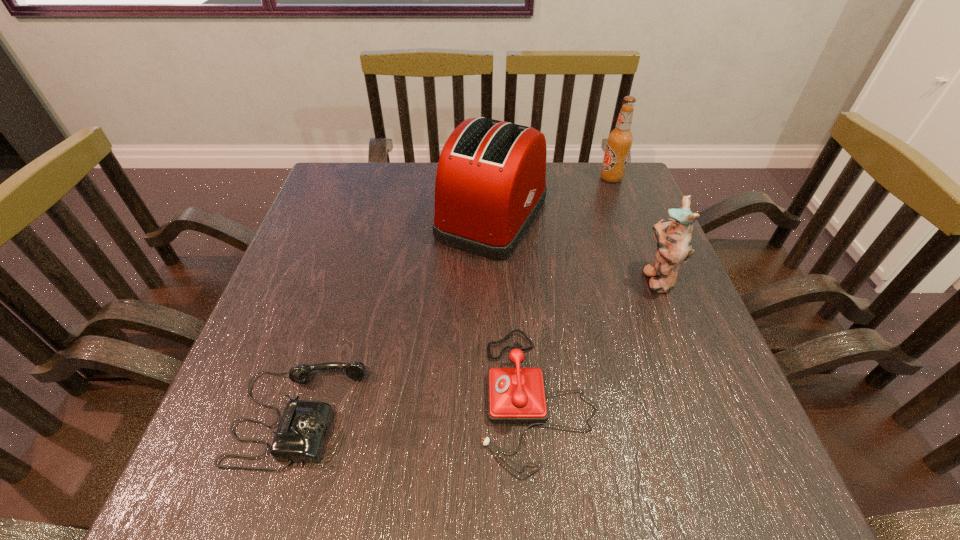
Identify the location of vacant area between the right telephone and the leftmost object. (418, 406).

The image size is (960, 540). What are the coordinates of `vacant region between the leftmost object and the right telephone` in the screenshot? It's located at (418, 406).

You are a GUI agent. You are given a task and a screenshot of the screen. Output one action in this format:
    pyautogui.click(x=<x>, y=<y>)
    Task: Click on the free space between the toaster and the beer bottle
    
    Given the screenshot: What is the action you would take?
    pyautogui.click(x=552, y=197)

Where is `free space between the leftmost object and the right telephone`? The height and width of the screenshot is (540, 960). free space between the leftmost object and the right telephone is located at coordinates tap(418, 406).

In order to click on free spot between the beer bottle and the figurine in this screenshot , I will do `click(634, 228)`.

This screenshot has height=540, width=960. I want to click on free space between the right telephone and the toaster, so click(516, 306).

This screenshot has height=540, width=960. I want to click on empty location between the leftmost object and the toaster, so click(x=396, y=316).

At what (x,y) coordinates should I click in order to perform the action: click on empty space between the beer bottle and the right telephone. Please return your answer as a coordinate pair (x, y). This screenshot has width=960, height=540. Looking at the image, I should click on (574, 287).

In order to click on the fourth closest object to the toaster in this screenshot , I will do `click(301, 435)`.

Identify which object is the second nearest to the figurine. Please provide its 2D coordinates. Your answer should be formatted as a tuple, i.e. [(x, y)], where the tuple contains the x and y coordinates of a point satisfying the conditions above.

[(515, 395)]